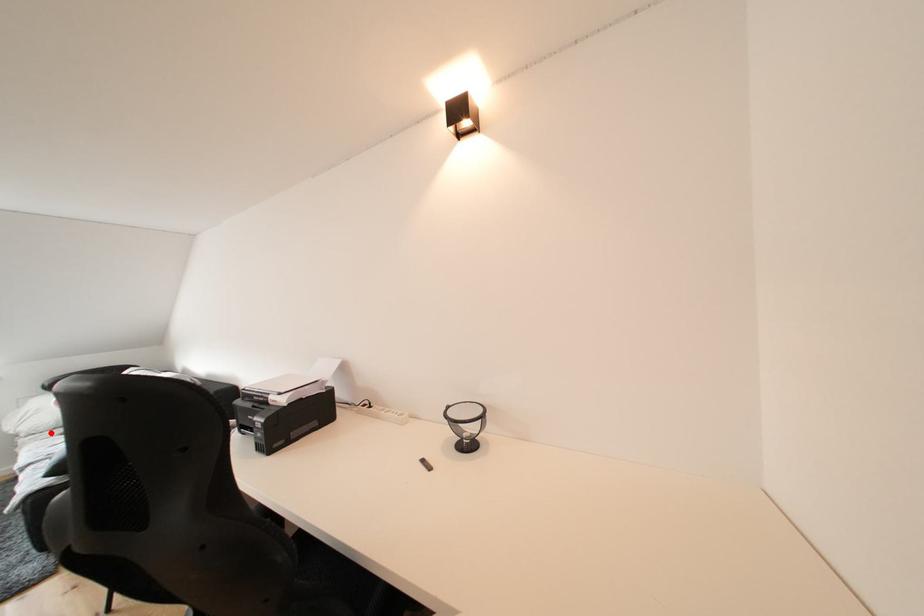
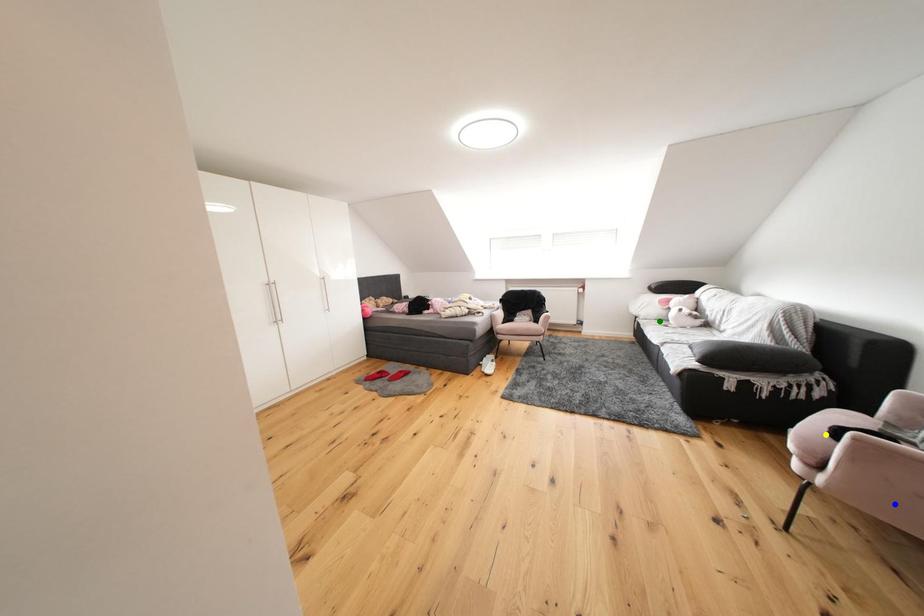
Question: I am providing you with two images of the same scene from different viewpoints. A red point is marked on the first image. You are given multiple points on the second image. In image 2, which mark is for the same physical point as the one in image 1?

Choices:
 (A) yellow point
 (B) blue point
 (C) green point

Answer: (C)